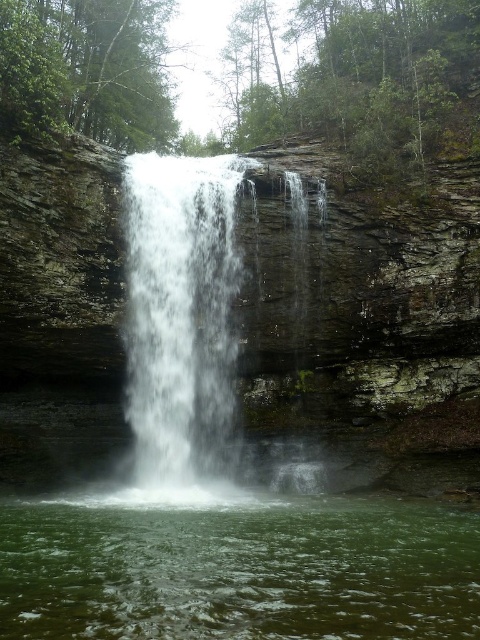
Question: Can you confirm if green liquid at center is positioned above white frothy water at center?

Choices:
 (A) yes
 (B) no

Answer: (B)

Question: Does green liquid at center have a lesser width compared to white frothy water at center?

Choices:
 (A) no
 (B) yes

Answer: (A)

Question: Which point is farther from the camera taking this photo?

Choices:
 (A) (178, 541)
 (B) (192, 314)

Answer: (B)

Question: Does green liquid at center appear on the right side of white frothy water at center?

Choices:
 (A) yes
 (B) no

Answer: (A)